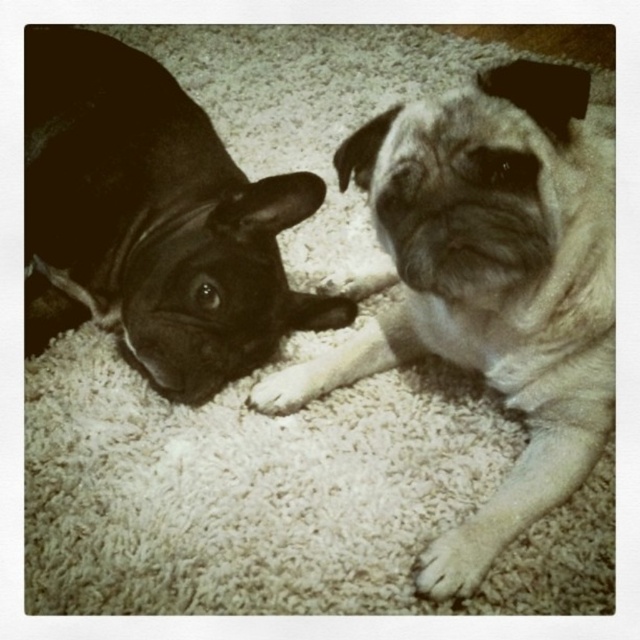
Question: Is fuzzy beige pug at center positioned in front of white fur at center?

Choices:
 (A) yes
 (B) no

Answer: (A)

Question: Which object is positioned farthest from the white fur at lower right?

Choices:
 (A) shiny black dog at left
 (B) white fur at center

Answer: (A)

Question: Which of these objects is positioned closest to the fuzzy beige pug at center?

Choices:
 (A) white fur at lower right
 (B) white fur at center
 (C) shiny black dog at left

Answer: (A)

Question: Can you confirm if fuzzy beige pug at center is positioned below white fur at center?

Choices:
 (A) no
 (B) yes

Answer: (A)

Question: Can you confirm if shiny black dog at left is positioned to the right of white fur at center?

Choices:
 (A) no
 (B) yes

Answer: (A)

Question: Which is farther from the shiny black dog at left?

Choices:
 (A) fuzzy beige pug at center
 (B) white fur at center
 (C) white fur at lower right

Answer: (C)